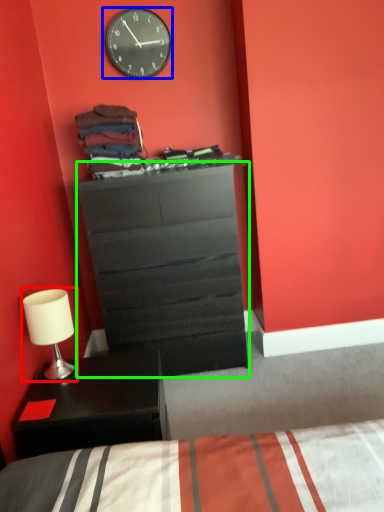
Question: Considering the real-world distances, which object is closest to table lamp (highlighted by a red box)? wall clock (highlighted by a blue box) or chest of drawers (highlighted by a green box).

Choices:
 (A) wall clock
 (B) chest of drawers

Answer: (B)